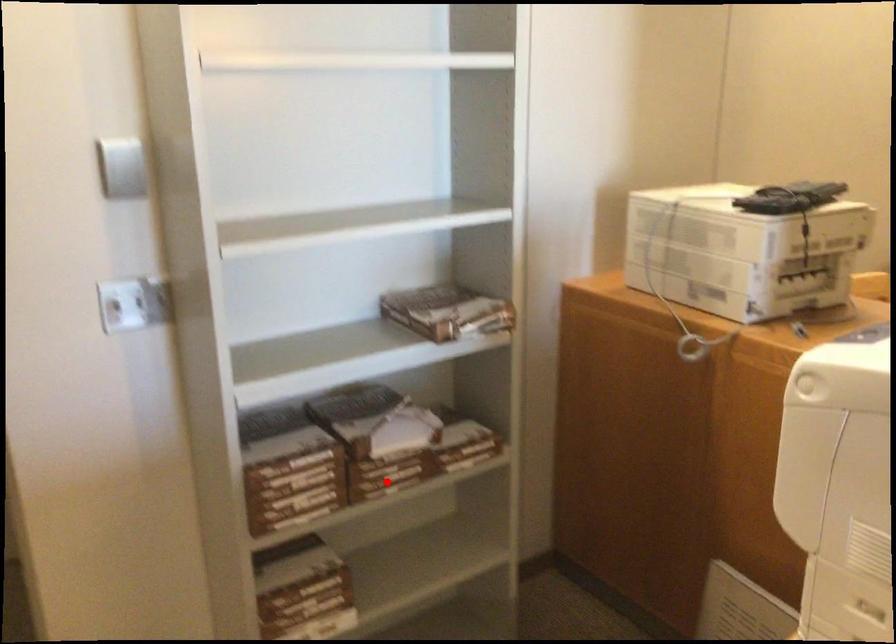
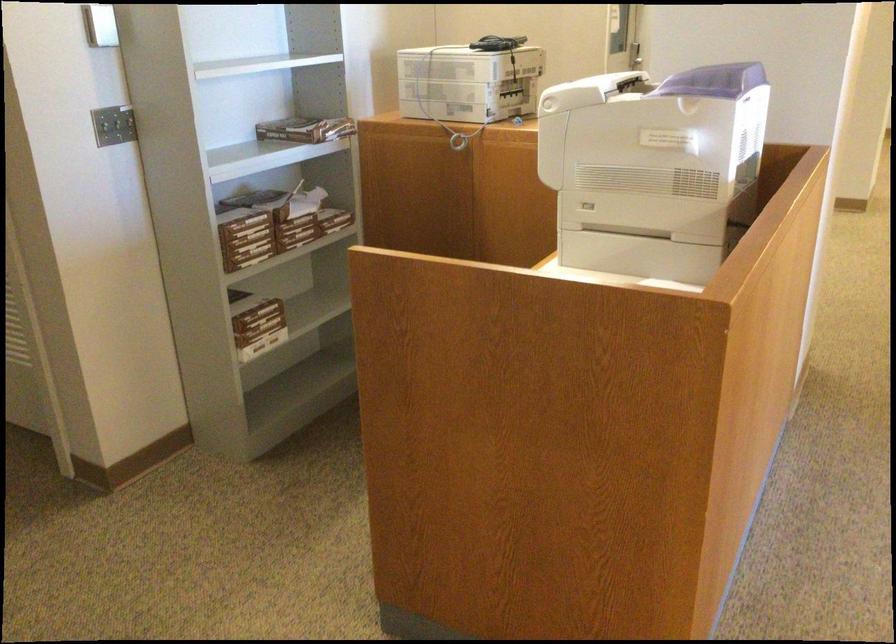
The point at the highlighted location is marked in the first image. Where is the corresponding point in the second image?

(297, 231)